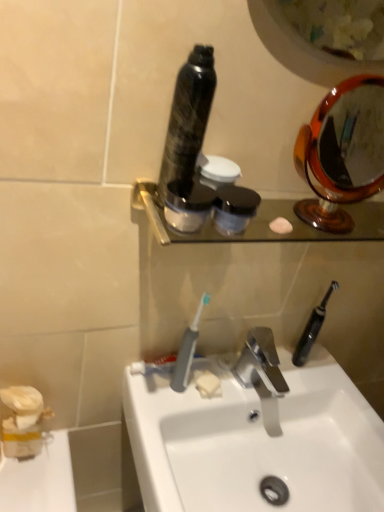
Identify the location of black plastic toothbrush at right, the first toothbrush in the back-to-front sequence. This screenshot has width=384, height=512. (312, 328).

This screenshot has height=512, width=384. What are the coordinates of `satin black bottle at center, the 2th mouthwash when ordered from bottom to top` in the screenshot? It's located at (188, 205).

The width and height of the screenshot is (384, 512). Describe the element at coordinates (261, 374) in the screenshot. I see `polished chrome faucet at center` at that location.

Where is `orange glass mirror at upper right`? The height and width of the screenshot is (512, 384). orange glass mirror at upper right is located at coordinates (342, 152).

Identify the location of soap on the left of orange glass mirror at upper right. (208, 385).

Which of these two, orange glass mirror at upper right or white matte soap at center, stands taller?

With more height is orange glass mirror at upper right.

In terms of size, does orange glass mirror at upper right appear bigger or smaller than white matte soap at center?

Clearly, orange glass mirror at upper right is larger in size than white matte soap at center.

In terms of height, does white matte soap at center look taller or shorter compared to polished chrome faucet at center?

Considering their sizes, white matte soap at center has less height than polished chrome faucet at center.

Would you say white matte soap at center contains polished chrome faucet at center?

Actually, polished chrome faucet at center is outside white matte soap at center.

Is white matte soap at center oriented away from polished chrome faucet at center?

No, white matte soap at center is not facing the opposite direction of polished chrome faucet at center.

Considering the positions of points (209, 375) and (275, 425), is point (209, 375) closer to camera compared to point (275, 425)?

Yes, point (209, 375) is closer to viewer.

Considering the relative positions of white glossy sink at center and polished chrome faucet at center in the image provided, is white glossy sink at center to the right of polished chrome faucet at center from the viewer's perspective?

In fact, white glossy sink at center is to the left of polished chrome faucet at center.

Which is nearer, (299,444) or (240,357)?

Point (299,444) is closer to the camera than point (240,357).

The height and width of the screenshot is (512, 384). In order to click on tap behind the white glossy sink at center in this screenshot , I will do `click(261, 374)`.

How many degrees apart are the facing directions of white glossy sink at center and polished chrome faucet at center?

The angle between the facing direction of white glossy sink at center and the facing direction of polished chrome faucet at center is 0.686 degrees.

From a real-world perspective, who is located lower, satin black bottle at center, acting as the 2th mouthwash starting from the top, or black matte jar at center, the first mouthwash from the bottom?

In real-world perspective, black matte jar at center, the first mouthwash from the bottom, is lower.

Is satin black bottle at center, acting as the 2th mouthwash starting from the top, thinner than black matte jar at center, marked as the third mouthwash in a top-to-bottom arrangement?

Indeed, satin black bottle at center, acting as the 2th mouthwash starting from the top, has a lesser width compared to black matte jar at center, marked as the third mouthwash in a top-to-bottom arrangement.

Which is in front, point (174, 227) or point (239, 218)?

The point (239, 218) is closer.

Does white glossy sink at center turn towards white matte soap at center?

No, white glossy sink at center is not turned towards white matte soap at center.

Is white glossy sink at center to the right of white matte soap at center from the viewer's perspective?

Yes.

Considering the relative sizes of white glossy sink at center and white matte soap at center in the image provided, is white glossy sink at center smaller than white matte soap at center?

Actually, white glossy sink at center might be larger than white matte soap at center.

From a real-world perspective, which is physically above, white glossy sink at center or white matte soap at center?

white matte soap at center.

Is orange glass mirror at upper right facing towards shiny black bottle at center, arranged as the 3th mouthwash when ordered from the bottom?

No, orange glass mirror at upper right is not aimed at shiny black bottle at center, arranged as the 3th mouthwash when ordered from the bottom.

From a real-world perspective, is orange glass mirror at upper right on top of shiny black bottle at center, arranged as the 3th mouthwash when ordered from the bottom?

Incorrect, from a real-world perspective, orange glass mirror at upper right is lower than shiny black bottle at center, arranged as the 3th mouthwash when ordered from the bottom.

Is shiny black bottle at center, arranged as the 3th mouthwash when ordered from the bottom, completely or partially inside orange glass mirror at upper right?

No.

Which of these two, black matte jar at center, marked as the third mouthwash in a top-to-bottom arrangement, or white matte soap at center, is bigger?

Bigger between the two is black matte jar at center, marked as the third mouthwash in a top-to-bottom arrangement.

From a real-world perspective, which object rests below the other?

From a 3D spatial view, white matte soap at center is below.

At what (x,y) coordinates should I click in order to perform the action: click on soap that appears behind the black matte jar at center, marked as the third mouthwash in a top-to-bottom arrangement. Please return your answer as a coordinate pair (x, y). Looking at the image, I should click on (208, 385).

Locate an element on the screen. Image resolution: width=384 pixels, height=512 pixels. mirror on the right of white matte soap at center is located at coordinates (342, 152).

This screenshot has height=512, width=384. I want to click on tap above the white matte soap at center (from the image's perspective), so click(x=261, y=374).

Based on their spatial positions, is shiny black bottle at center, the 1th mouthwash positioned from the top, or polished chrome faucet at center further from black plastic toothbrush at right, the first toothbrush in the back-to-front sequence?

shiny black bottle at center, the 1th mouthwash positioned from the top, is further to black plastic toothbrush at right, the first toothbrush in the back-to-front sequence.

Considering their positions, is black plastic toothbrush at right, which is counted as the second toothbrush, starting from the left, positioned closer to gray plastic toothbrush at center, the 1th toothbrush from the front, than white matte soap at center?

Based on the image, white matte soap at center appears to be nearer to gray plastic toothbrush at center, the 1th toothbrush from the front.

Estimate the real-world distances between objects in this image. Which object is closer to black plastic toothbrush at right, acting as the first toothbrush starting from the right, orange glass mirror at upper right or satin black bottle at center, the 2th mouthwash when ordered from bottom to top?

Among the two, satin black bottle at center, the 2th mouthwash when ordered from bottom to top, is located nearer to black plastic toothbrush at right, acting as the first toothbrush starting from the right.

When comparing their distances from white glossy sink at center, does polished chrome faucet at center or gray plastic toothbrush at center, the 2th toothbrush positioned from the right, seem closer?

Among the two, polished chrome faucet at center is located nearer to white glossy sink at center.

Estimate the real-world distances between objects in this image. Which object is closer to shiny black bottle at center, arranged as the 3th mouthwash when ordered from the bottom, white glossy sink at center or orange glass mirror at upper right?

white glossy sink at center is closer to shiny black bottle at center, arranged as the 3th mouthwash when ordered from the bottom.

Looking at the image, which one is located closer to shiny black bottle at center, arranged as the 3th mouthwash when ordered from the bottom, gray plastic toothbrush at center, the second toothbrush positioned from the back, or white matte soap at center?

gray plastic toothbrush at center, the second toothbrush positioned from the back.

From the picture: Estimate the real-world distances between objects in this image. Which object is further from white matte soap at center, polished chrome faucet at center or white glossy sink at center?

The object further to white matte soap at center is white glossy sink at center.

When comparing their distances from black matte jar at center, the first mouthwash from the bottom, does orange glass mirror at upper right or shiny black bottle at center, the 1th mouthwash positioned from the top, seem further?

The object further to black matte jar at center, the first mouthwash from the bottom, is orange glass mirror at upper right.

Where is `mirror between shiny black bottle at center, the 1th mouthwash positioned from the top, and white glossy sink at center from top to bottom`? The height and width of the screenshot is (512, 384). mirror between shiny black bottle at center, the 1th mouthwash positioned from the top, and white glossy sink at center from top to bottom is located at coordinates (342, 152).

The width and height of the screenshot is (384, 512). I want to click on mouthwash between satin black bottle at center, acting as the 2th mouthwash starting from the top, and white matte soap at center from top to bottom, so click(x=234, y=208).

Find the location of `tap that lies between orange glass mirror at upper right and white glossy sink at center from top to bottom`. tap that lies between orange glass mirror at upper right and white glossy sink at center from top to bottom is located at coordinates (261, 374).

The height and width of the screenshot is (512, 384). In order to click on mouthwash between shiny black bottle at center, arranged as the 3th mouthwash when ordered from the bottom, and black matte jar at center, the first mouthwash from the bottom, in the vertical direction in this screenshot , I will do `click(188, 205)`.